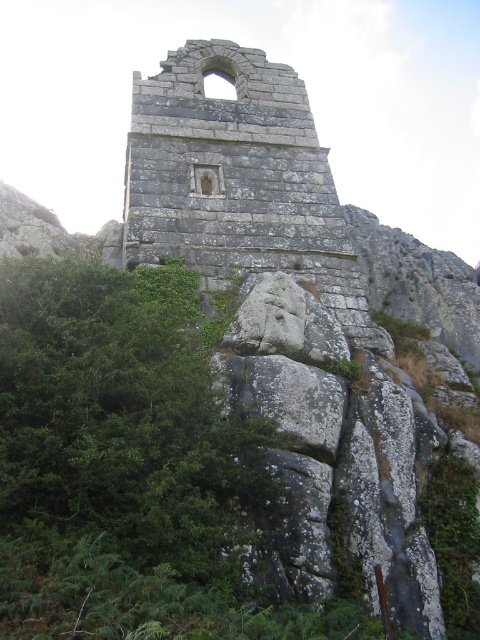
Who is taller, gray stone ruins at center or green leafy shrub at center?

With more height is gray stone ruins at center.

Is gray stone ruins at center bigger than green leafy shrub at center?

Correct, gray stone ruins at center is larger in size than green leafy shrub at center.

Who is more forward, (349, 324) or (468, 618)?

Point (468, 618) is more forward.

You are a GUI agent. You are given a task and a screenshot of the screen. Output one action in this format:
    pyautogui.click(x=<x>, y=<y>)
    Task: Click on the gray stone ruins at center
    
    Given the screenshot: What is the action you would take?
    pyautogui.click(x=239, y=180)